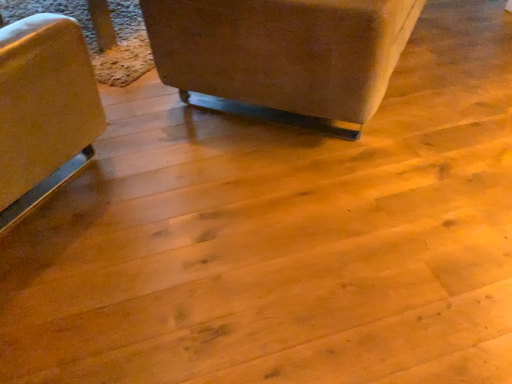
Question: Should I look upward or downward to see suede-like brown couch at upper center?

Choices:
 (A) down
 (B) up

Answer: (B)